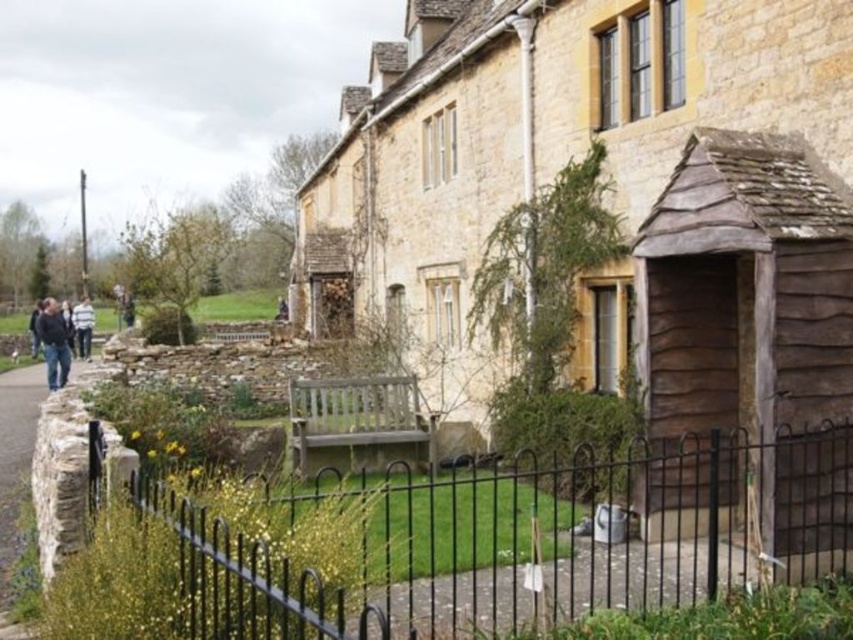
You are standing at the point marked by coordinates point [613,193] in the image. What object are you directly in front of?

The point [613,193] marks the wooden shed at center right, so you are directly in front of the wooden shed at center right.

Based on the photo, you are a visitor standing at the entrance of the stone building and want to walk towards the wooden shed. There is a stone paved path at lower left and dark blue jeans at left in your way. Which object is lower in height that you might need to step over?

The stone paved path at lower left has a lesser height compared to dark blue jeans at left, so you would need to step over the dark blue jeans at left since it is taller.